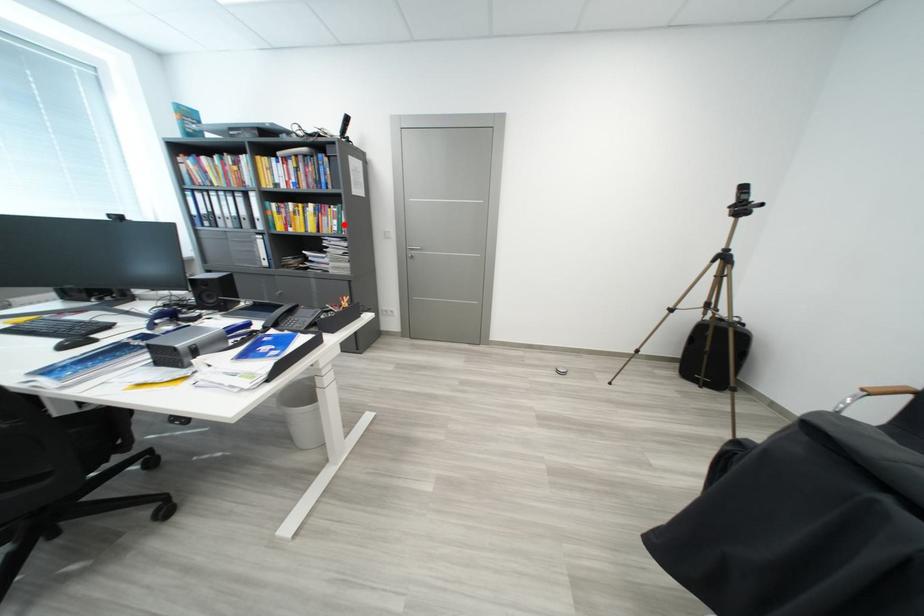
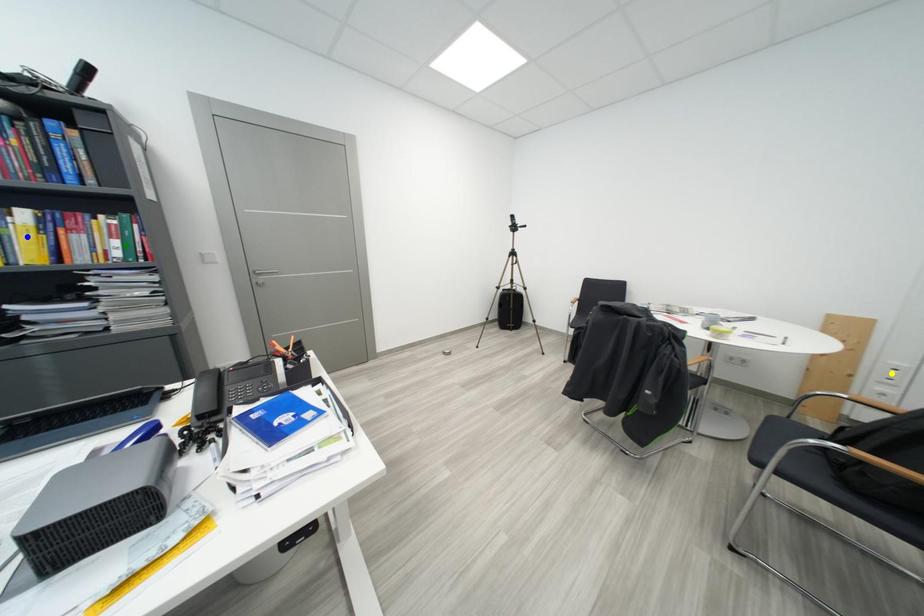
Question: I am providing you with two images of the same scene from different viewpoints. A red point is marked on the first image. You are given multiple points on the second image. In image 2, which mark is for the same physical point as the one in image 1?

Choices:
 (A) yellow point
 (B) green point
 (C) blue point

Answer: (B)